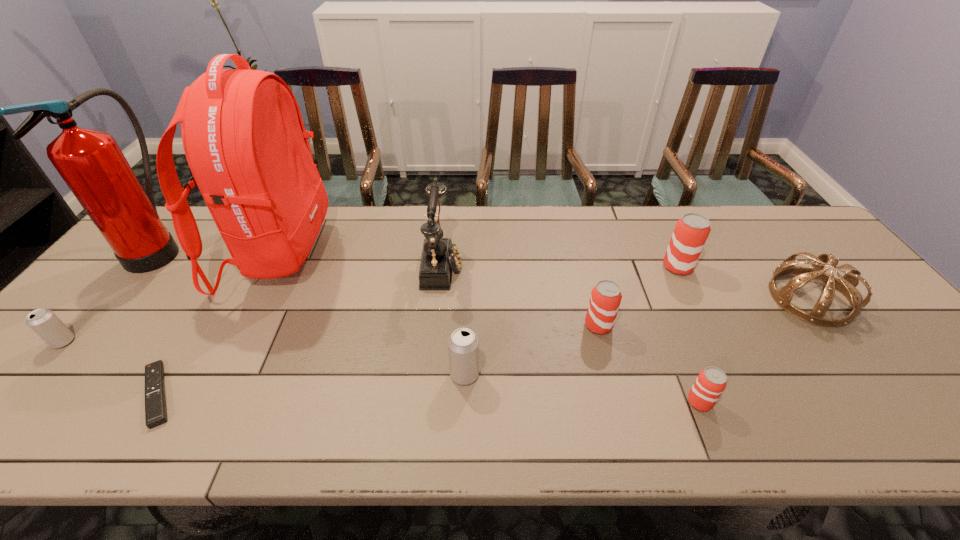
Identify the location of backpack. (243, 135).

You are a GUI agent. You are given a task and a screenshot of the screen. Output one action in this format:
    pyautogui.click(x=<x>, y=<y>)
    Task: Click on the fire extinguisher
    
    Given the screenshot: What is the action you would take?
    pyautogui.click(x=91, y=163)

Where is `telephone`? This screenshot has width=960, height=540. telephone is located at coordinates (439, 256).

At what (x,y) coordinates should I click in order to perform the action: click on the eighth shortest object. Please return your answer as a coordinate pair (x, y). Looking at the image, I should click on (439, 256).

Identify the location of the rightmost beer can. This screenshot has width=960, height=540. (691, 231).

Find the location of a particular element. This screenshot has height=540, width=960. the biggest orange beer can is located at coordinates (691, 231).

Where is `the rightmost object`? The width and height of the screenshot is (960, 540). the rightmost object is located at coordinates (846, 285).

You are a GUI agent. You are given a task and a screenshot of the screen. Output one action in this format:
    pyautogui.click(x=<x>, y=<y>)
    Task: Click on the tiara
    This screenshot has height=540, width=960.
    Given the screenshot: What is the action you would take?
    pyautogui.click(x=846, y=285)

Identify the location of the fourth object from right to left. This screenshot has width=960, height=540. point(605,299).

I want to click on the third beer can from left to right, so click(x=605, y=299).